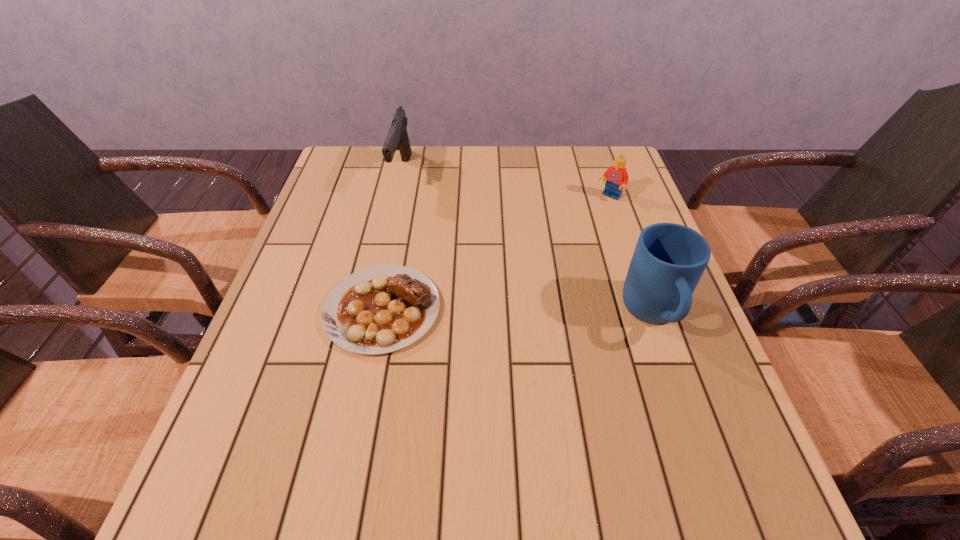
Where is `free spot between the mug and the Lego`? This screenshot has height=540, width=960. free spot between the mug and the Lego is located at coordinates tap(632, 256).

Locate an element on the screen. Image resolution: width=960 pixels, height=540 pixels. vacant space in between the gun and the mug is located at coordinates (528, 244).

Find the location of a particular element. Image resolution: width=960 pixels, height=540 pixels. the closest object to the mug is located at coordinates (616, 176).

Find the location of a particular element. The height and width of the screenshot is (540, 960). the second closest object to the shortest object is located at coordinates (669, 259).

Where is `free space that satisfies the following two spatial constraints: 1. on the front side of the steak; 2. on the left side of the gun`? Image resolution: width=960 pixels, height=540 pixels. free space that satisfies the following two spatial constraints: 1. on the front side of the steak; 2. on the left side of the gun is located at coordinates (372, 309).

Find the location of a particular element. free space in the image that satisfies the following two spatial constraints: 1. on the front side of the shortest object; 2. on the left side of the gun is located at coordinates (372, 309).